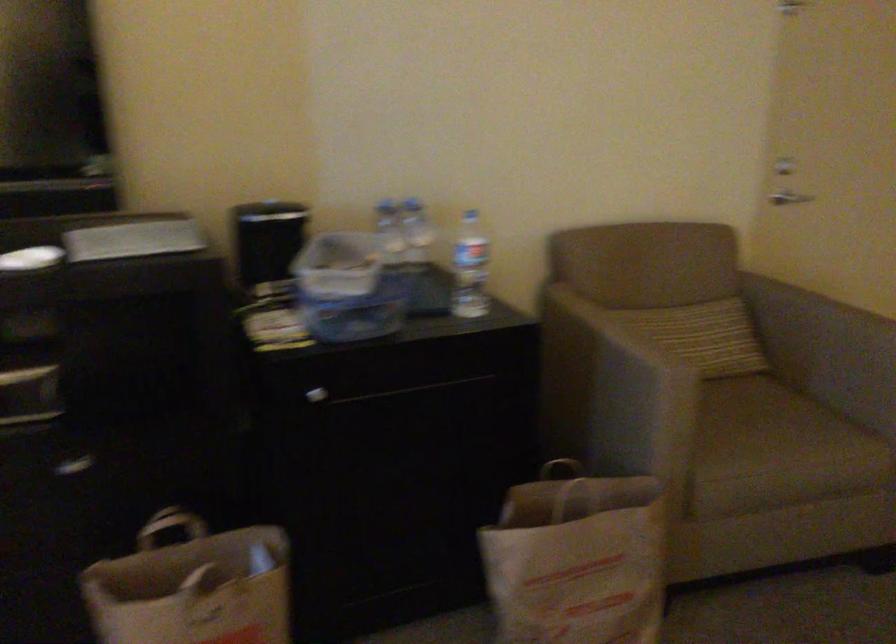
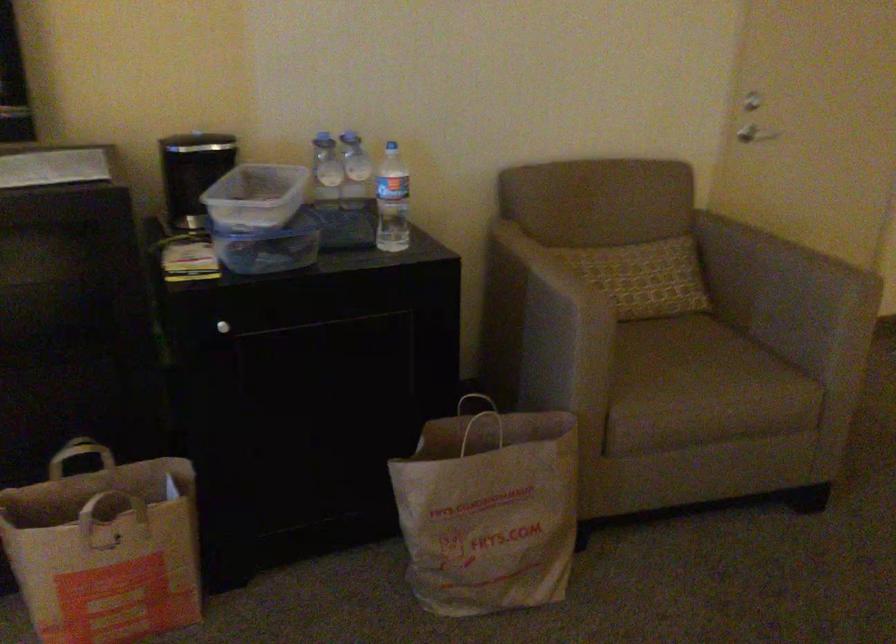
The point at (780, 426) is marked in the first image. Where is the corresponding point in the second image?

(707, 366)